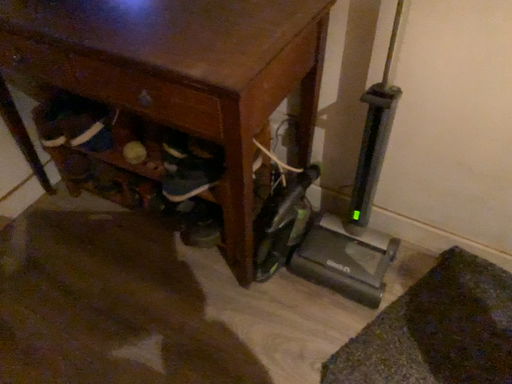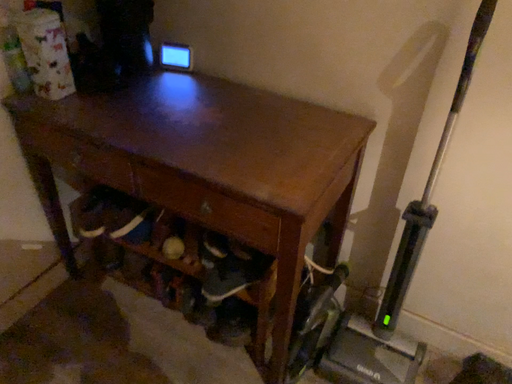
Question: Which way did the camera rotate in the video?

Choices:
 (A) rotated upward
 (B) rotated downward

Answer: (A)